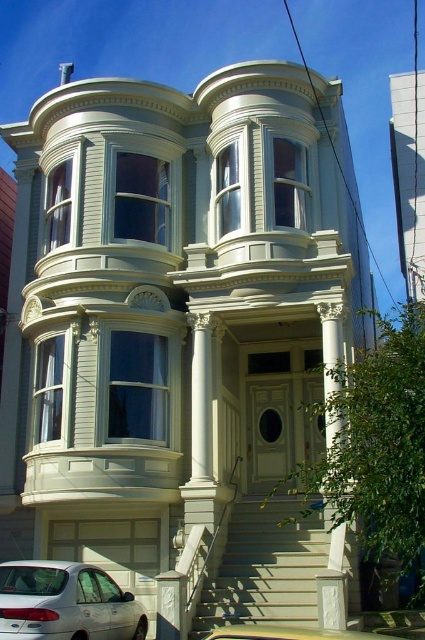
Can you confirm if smooth beige stairs at center is positioned above yellow matte taxi at lower center?

Indeed, smooth beige stairs at center is positioned over yellow matte taxi at lower center.

Is smooth beige stairs at center positioned before yellow matte taxi at lower center?

No, it is behind yellow matte taxi at lower center.

The width and height of the screenshot is (425, 640). What are the coordinates of `smooth beige stairs at center` in the screenshot? It's located at (265, 566).

Identify the location of smooth beige stairs at center. (265, 566).

Is white carved column at right smaller than yellow matte taxi at lower center?

Yes, white carved column at right is smaller than yellow matte taxi at lower center.

Which is in front, point (320, 307) or point (336, 636)?

Point (336, 636) is in front.

Which is in front, point (320, 600) or point (243, 636)?

Point (243, 636)

The height and width of the screenshot is (640, 425). What are the coordinates of `white carved column at right` in the screenshot? It's located at (333, 586).

Which is behind, point (62, 612) or point (294, 630)?

The point (62, 612) is more distant.

Find the location of a particular element. silver metallic sedan at lower left is located at coordinates (65, 602).

Locate an element on the screen. silver metallic sedan at lower left is located at coordinates (65, 602).

What are the coordinates of `silver metallic sedan at lower left` in the screenshot? It's located at (65, 602).